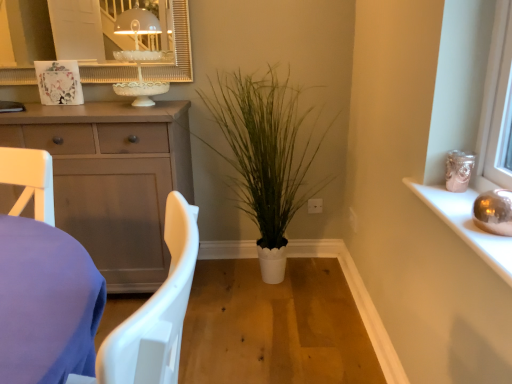
Question: From the image's perspective, is matte gray cabinet at left beneath white textured mirror at upper center?

Choices:
 (A) no
 (B) yes

Answer: (B)

Question: Is matte gray cabinet at left further to the viewer compared to white textured mirror at upper center?

Choices:
 (A) no
 (B) yes

Answer: (A)

Question: Is matte gray cabinet at left to the left of white textured mirror at upper center from the viewer's perspective?

Choices:
 (A) no
 (B) yes

Answer: (B)

Question: Is matte gray cabinet at left oriented away from white textured mirror at upper center?

Choices:
 (A) yes
 (B) no

Answer: (B)

Question: Can you confirm if matte gray cabinet at left is positioned to the right of white textured mirror at upper center?

Choices:
 (A) no
 (B) yes

Answer: (A)

Question: Does matte gray cabinet at left turn towards white textured mirror at upper center?

Choices:
 (A) yes
 (B) no

Answer: (B)

Question: Would you say matte gray cabinet at left is outside metallic silver sphere at upper right?

Choices:
 (A) yes
 (B) no

Answer: (A)

Question: Could metallic silver sphere at upper right be considered to be inside matte gray cabinet at left?

Choices:
 (A) yes
 (B) no

Answer: (B)

Question: Is matte gray cabinet at left beside metallic silver sphere at upper right?

Choices:
 (A) yes
 (B) no

Answer: (B)

Question: Is matte gray cabinet at left closer to the viewer compared to metallic silver sphere at upper right?

Choices:
 (A) yes
 (B) no

Answer: (B)

Question: Is the depth of matte gray cabinet at left greater than that of metallic silver sphere at upper right?

Choices:
 (A) yes
 (B) no

Answer: (A)

Question: Is matte gray cabinet at left oriented towards metallic silver sphere at upper right?

Choices:
 (A) yes
 (B) no

Answer: (B)

Question: Considering the relative sizes of white textured mirror at upper center and matte gray cabinet at left in the image provided, is white textured mirror at upper center bigger than matte gray cabinet at left?

Choices:
 (A) yes
 (B) no

Answer: (B)